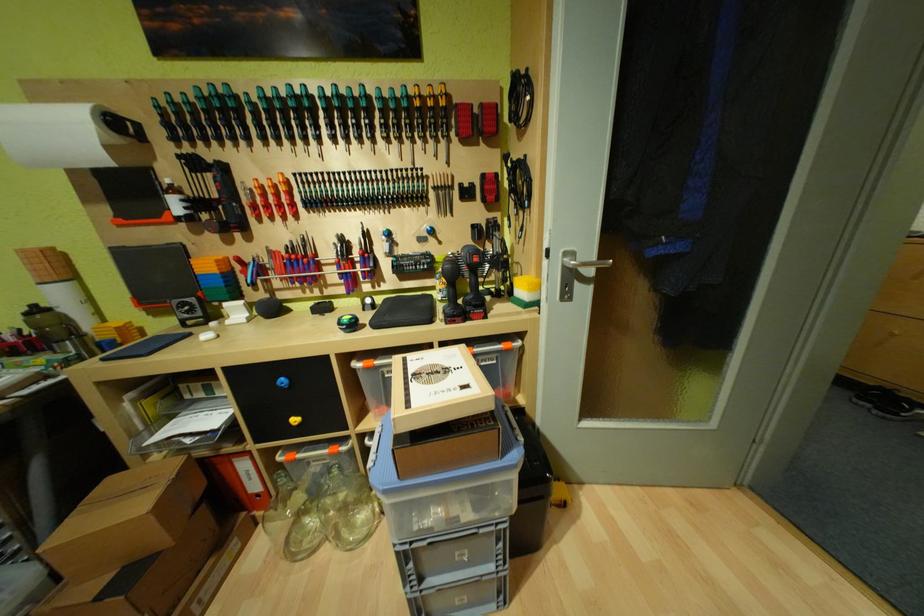
Describe the element at coordinates (283, 382) in the screenshot. I see `the blue drawer knob` at that location.